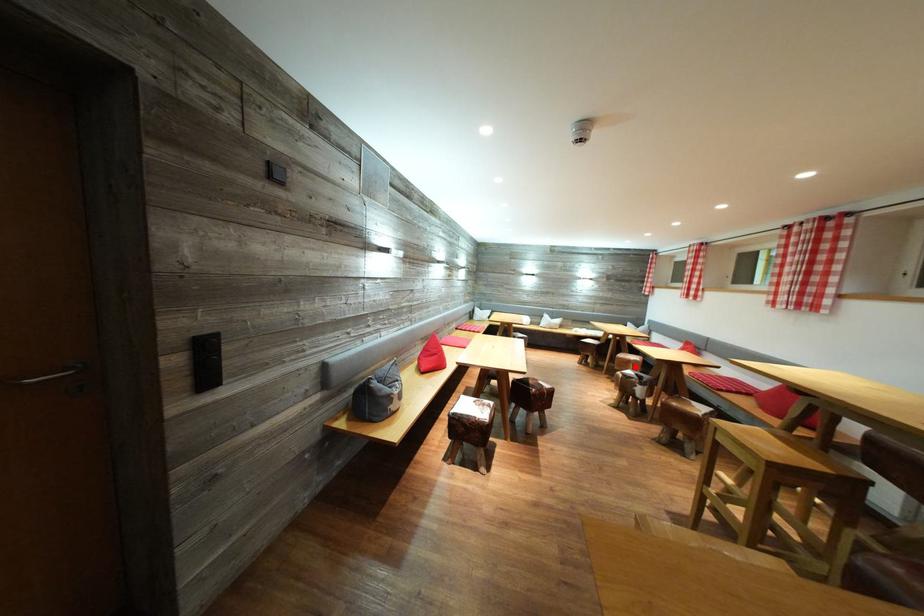
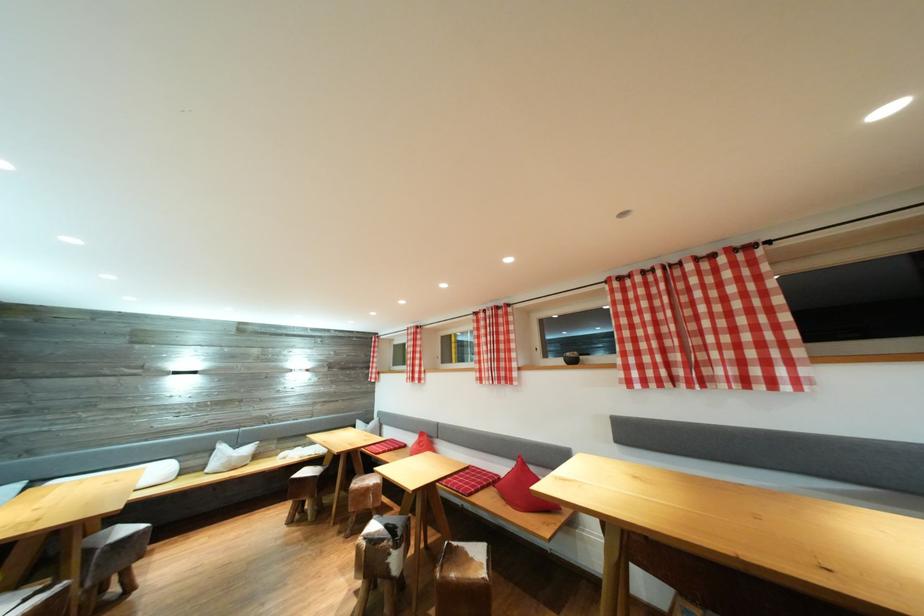
Question: I am providing you with two images of the same scene from different viewpoints. In image1, a red point is highlighted. Considering the same 3D point in image2, which of the following is correct?

Choices:
 (A) It is closer
 (B) It is farther

Answer: (B)